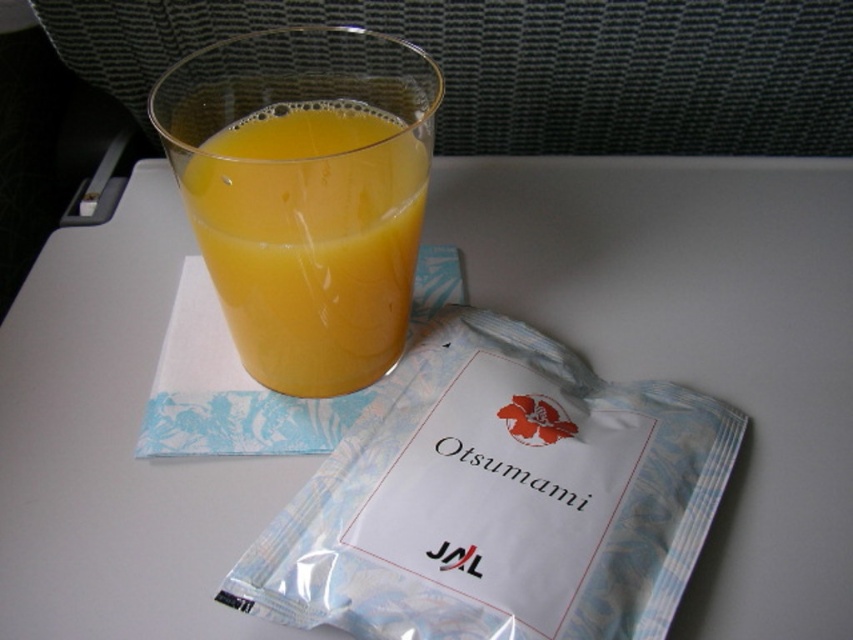
You are a passenger on a JAL flight and want to reach the point at coordinates (421, 428) on your tray table. If your hand is 10 inches long, can you comfortably reach that point from your current seated position?

The point at coordinates (421, 428) is 20.43 inches away from the camera. Since your hand is only 10 inches long, you cannot comfortably reach that point from your current seated position.

You are a flight attendant checking the tray tables for passengers. You need to ensure that all items on the tray are within reach of the passengers. The airline requires that items must be no more than 16 inches away from the camera to be considered within reach. Is the transparent plastic pouch at upper center within the required distance?

The transparent plastic pouch at upper center is 15.79 inches away from the camera, which is within the 16 inches requirement. Therefore, it is within reach.